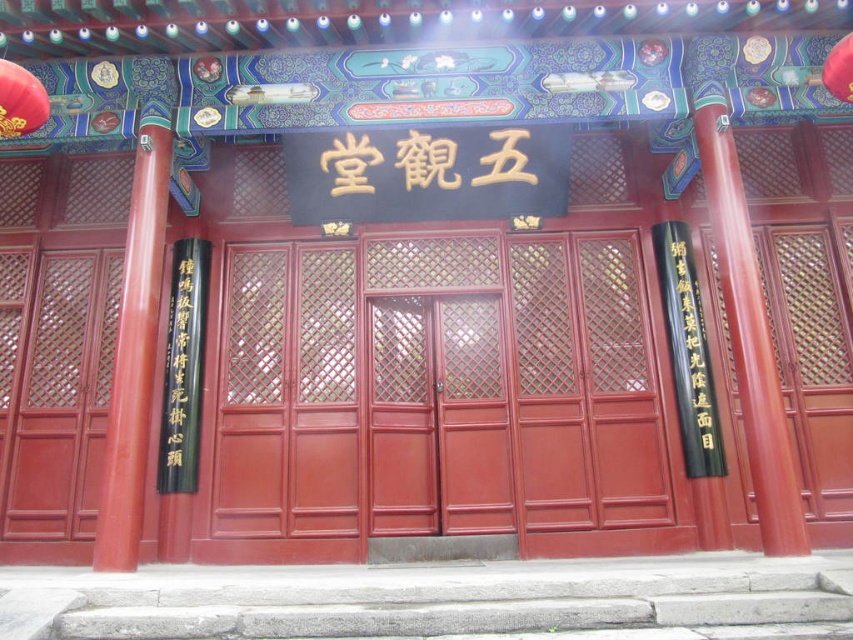
You are standing in front of the entrance of the traditional Chinese building. You want to enter the building through the matte wood door at center. However, there is a glossy wood pillar at right above it. Can you walk through the door without touching the pillar?

The matte wood door at center is positioned under the glossy wood pillar at right, so the pillar is above the door. Since the pillar is above the door, you can walk through the matte wood door at center without touching the glossy wood pillar at right.

You are standing at the entrance of the temple and notice two points marked on the structure. The first point is located at coordinate point [628,420] and the second at point [24,99]. Which point is closer to your eyes?

Point [24,99] is closer to your eyes because it is less further to the camera than point [628,420].